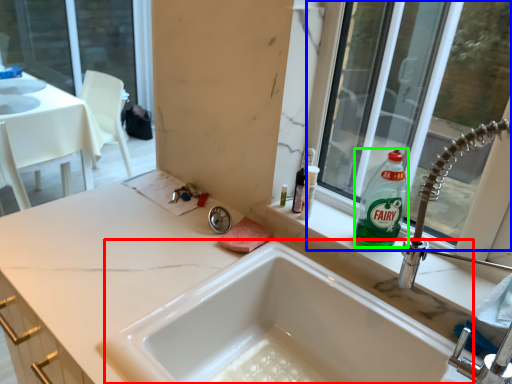
Question: Which is nearer to the tub (highlighted by a red box)? window (highlighted by a blue box) or cleaning product (highlighted by a green box).

Choices:
 (A) window
 (B) cleaning product

Answer: (B)